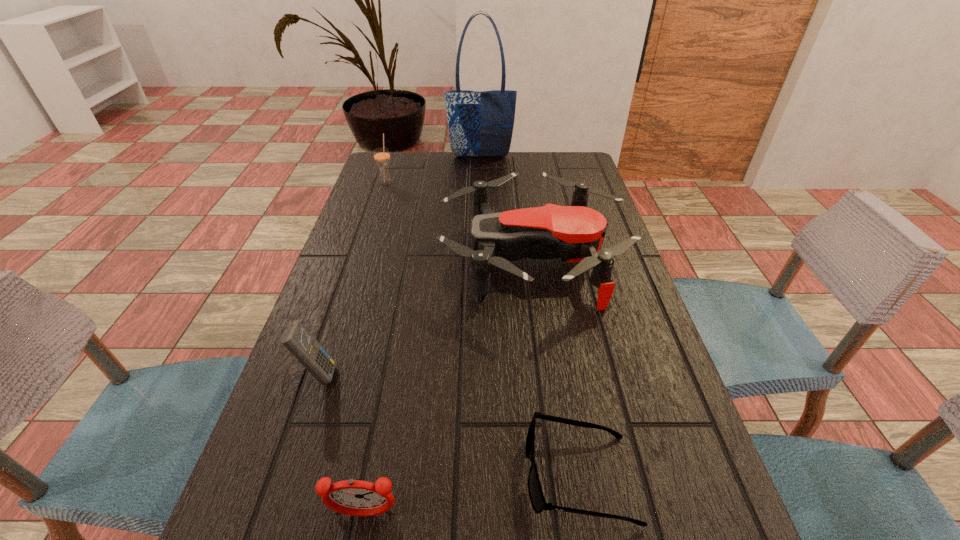
This screenshot has height=540, width=960. Find the location of `vacant space that is in between the sunglasses and the tallest object`. vacant space that is in between the sunglasses and the tallest object is located at coordinates (530, 316).

Identify the location of vacant space that's between the drone and the fourth object from right to left. This screenshot has width=960, height=540. (448, 387).

Locate an element on the screen. free point between the calculator and the second farthest object is located at coordinates (352, 278).

Find the location of a particular element. The image size is (960, 540). empty space between the shopping bag and the sunglasses is located at coordinates (530, 316).

Locate an element on the screen. This screenshot has width=960, height=540. vacant area that lies between the drone and the alarm clock is located at coordinates (448, 387).

Where is `vacant area that lies between the fourth nearest object and the second farthest object`? Image resolution: width=960 pixels, height=540 pixels. vacant area that lies between the fourth nearest object and the second farthest object is located at coordinates (459, 221).

Locate an element on the screen. The image size is (960, 540). free spot between the straw and the fourth object from right to left is located at coordinates (375, 349).

Image resolution: width=960 pixels, height=540 pixels. What are the coordinates of `free space between the third farthest object and the fourth object from right to left` in the screenshot? It's located at pos(448,387).

Locate an element on the screen. the fourth closest object to the fourth object from right to left is located at coordinates (381, 155).

Locate an element on the screen. the closest object to the straw is located at coordinates (481, 124).